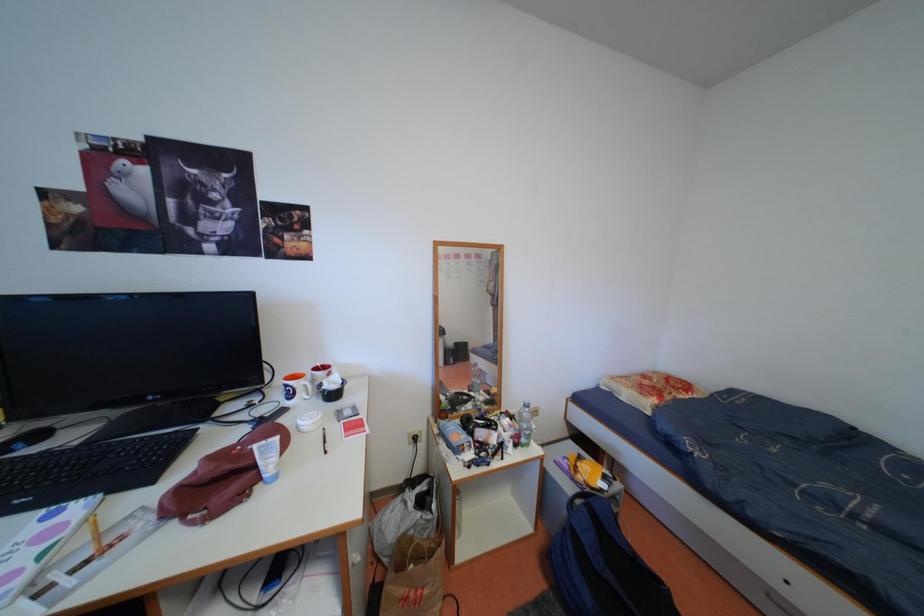
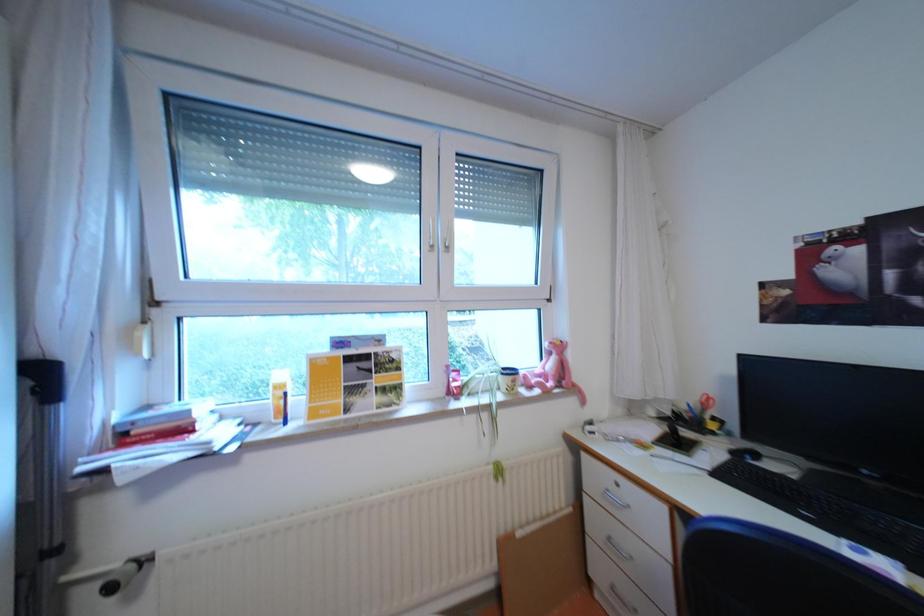
Question: Based on the continuous images, in which direction is the camera rotating? Reply with the corresponding letter.

Choices:
 (A) Left
 (B) Right
 (C) Up
 (D) Down

Answer: (A)